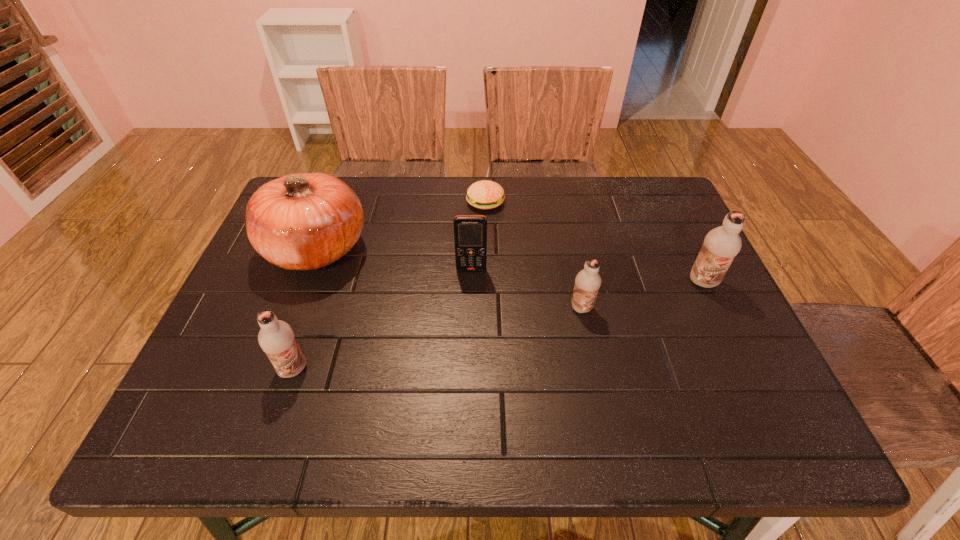
This screenshot has height=540, width=960. In order to click on location for an additional chocolate_milk to make spacing equal in this screenshot , I will do `click(445, 337)`.